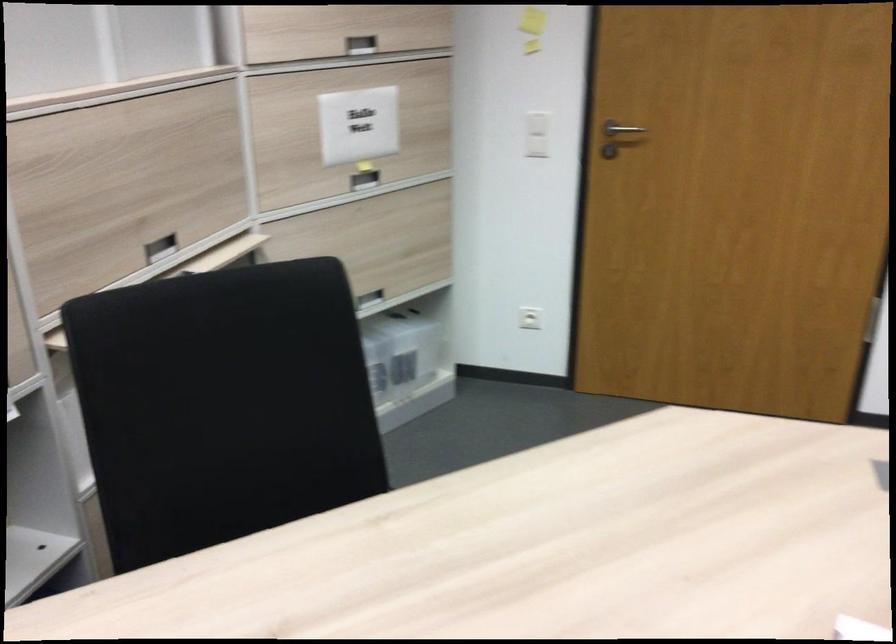
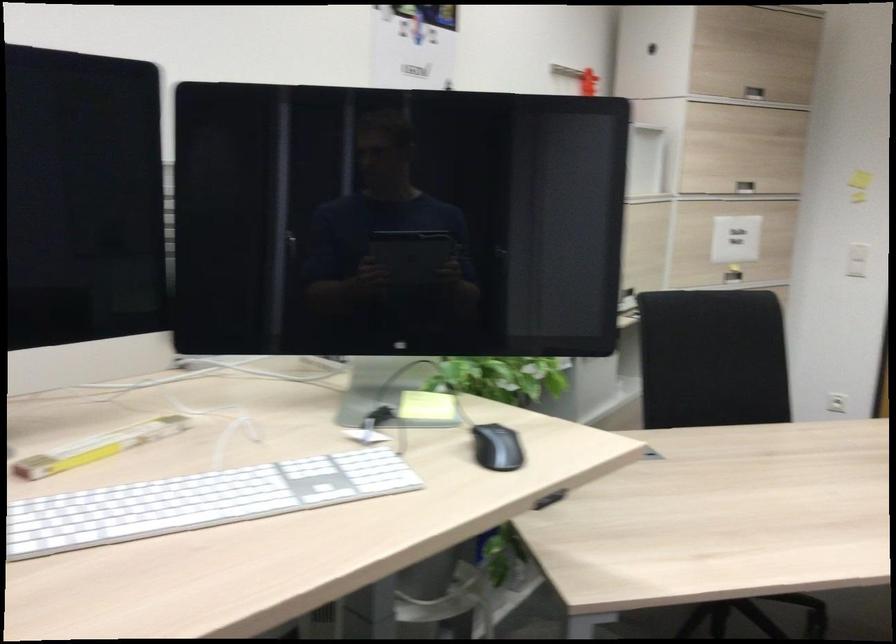
Question: I am providing you with two images of the same scene from different viewpoints. Which of the following objects are not visible in image2?

Choices:
 (A) recessed cabinet handle
 (B) red wall clamp
 (C) white light switch
 (D) brown sauce bottle

Answer: (A)